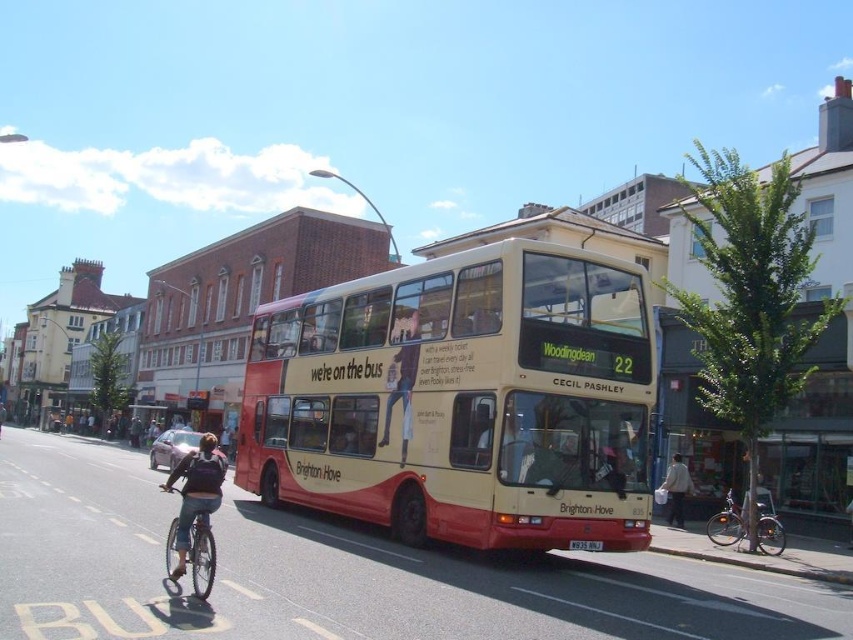
Does silver metallic bicycle at lower left have a lesser height compared to white cotton shirt at center?

Yes.

Between silver metallic bicycle at lower left and white cotton shirt at center, which one has more height?

white cotton shirt at center

Does point (195, 561) lie in front of point (677, 468)?

Yes, point (195, 561) is closer to viewer.

Where is `silver metallic bicycle at lower left`? The image size is (853, 640). silver metallic bicycle at lower left is located at coordinates (201, 554).

Between beige/yellow painted decker bus at center and silver metallic bicycle at lower left, which one appears on the right side from the viewer's perspective?

beige/yellow painted decker bus at center

Does beige/yellow painted decker bus at center have a greater height compared to silver metallic bicycle at lower left?

Correct, beige/yellow painted decker bus at center is much taller as silver metallic bicycle at lower left.

The image size is (853, 640). I want to click on beige/yellow painted decker bus at center, so click(460, 400).

Can you confirm if beige/yellow painted decker bus at center is positioned to the right of white cotton shirt at center?

No, beige/yellow painted decker bus at center is not to the right of white cotton shirt at center.

Is beige/yellow painted decker bus at center thinner than white cotton shirt at center?

No.

This screenshot has width=853, height=640. What do you see at coordinates (460, 400) in the screenshot? I see `beige/yellow painted decker bus at center` at bounding box center [460, 400].

Find the location of `beige/yellow painted decker bus at center`. beige/yellow painted decker bus at center is located at coordinates (x=460, y=400).